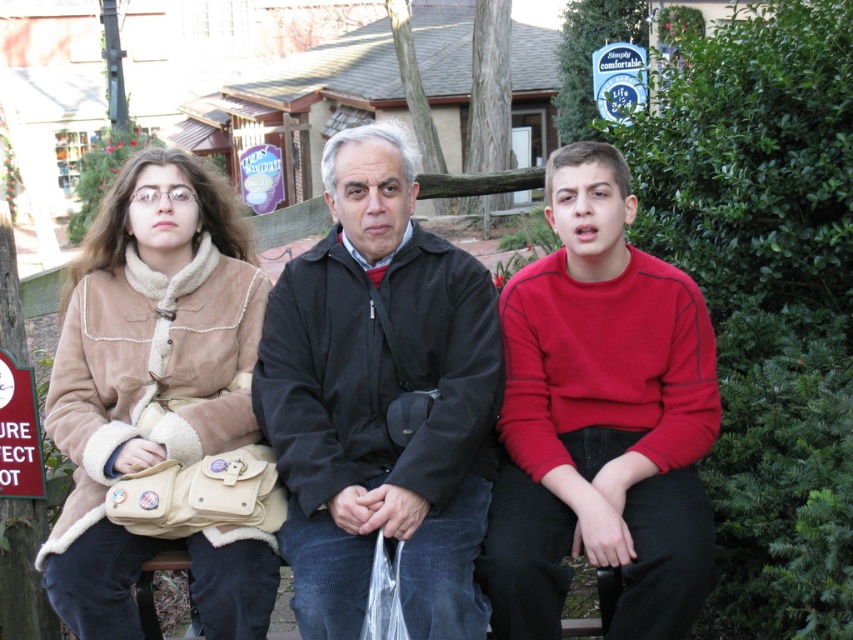
Question: Among these objects, which one is farthest from the camera?

Choices:
 (A) black matte jacket at center
 (B) beige suede jacket at left

Answer: (A)

Question: Is beige suede jacket at left to the right of red matte sweater at center from the viewer's perspective?

Choices:
 (A) yes
 (B) no

Answer: (B)

Question: Is beige suede jacket at left bigger than black matte jacket at center?

Choices:
 (A) yes
 (B) no

Answer: (A)

Question: Which object is closer to the camera taking this photo?

Choices:
 (A) red matte sweater at center
 (B) suede jacket at left
 (C) beige suede jacket at left

Answer: (C)

Question: Among these points, which one is nearest to the camera?

Choices:
 (A) (323, 436)
 (B) (194, 312)
 (C) (503, 502)
 (D) (260, 397)

Answer: (C)

Question: Can you confirm if beige suede jacket at left is wider than red matte sweater at center?

Choices:
 (A) yes
 (B) no

Answer: (A)